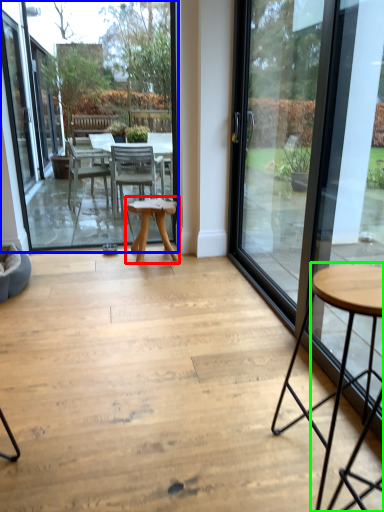
Question: Considering the real-world distances, which object is farthest from table (highlighted by a red box)? window screen (highlighted by a blue box) or coffee table (highlighted by a green box)?

Choices:
 (A) window screen
 (B) coffee table

Answer: (B)